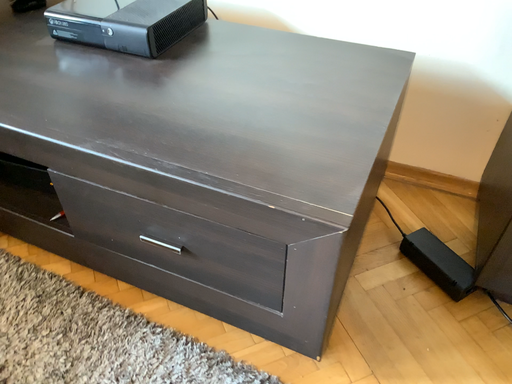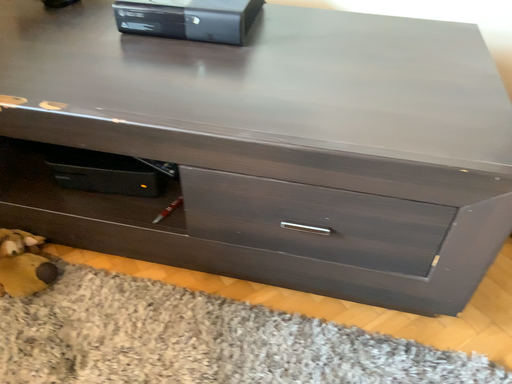
Question: Which way did the camera rotate in the video?

Choices:
 (A) rotated left
 (B) rotated right

Answer: (B)